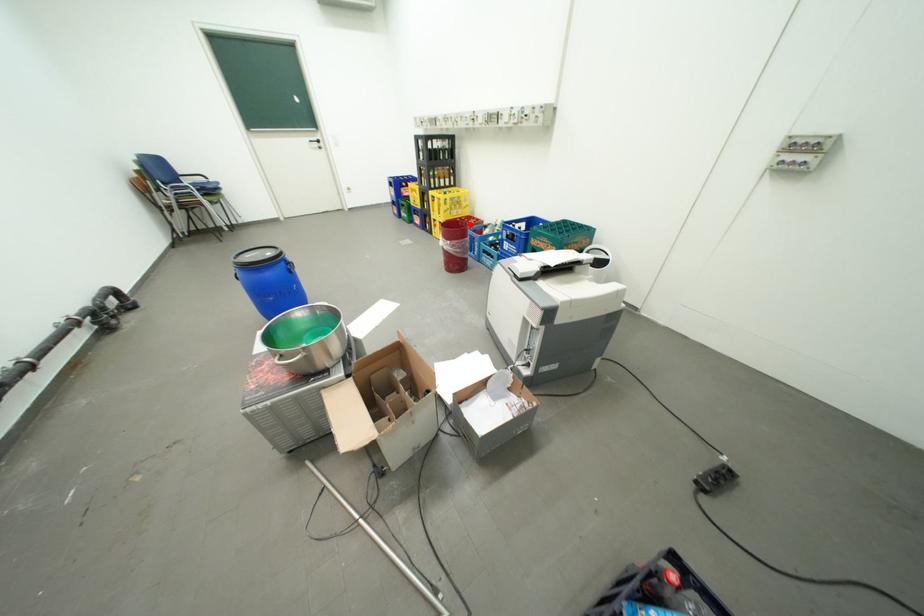
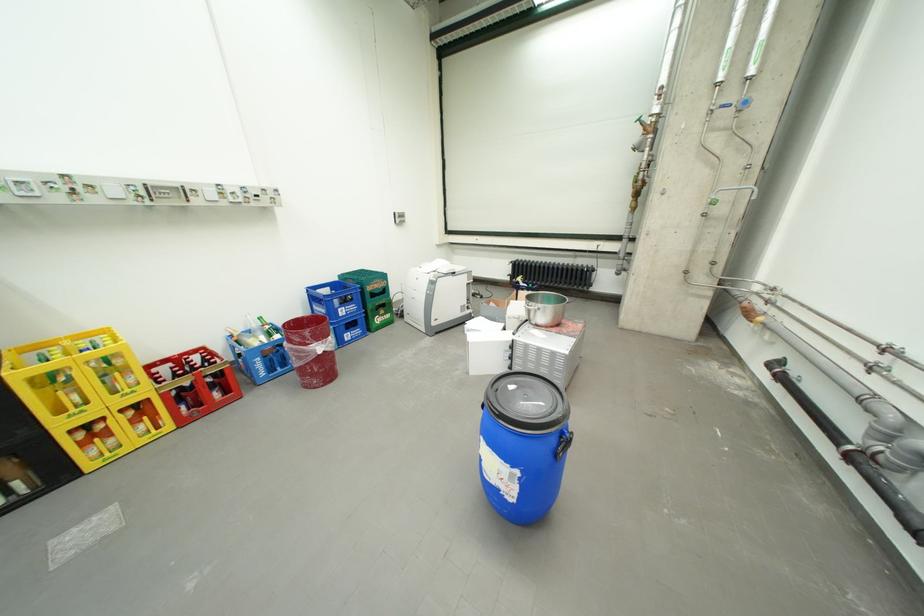
Question: I am providing you with two images of the same scene from different viewpoints. Image1 has a red point marked. In image2, the corresponding 3D location appears at what relative position? Reply with the corresponding letter.

Choices:
 (A) Closer
 (B) Farther

Answer: (B)